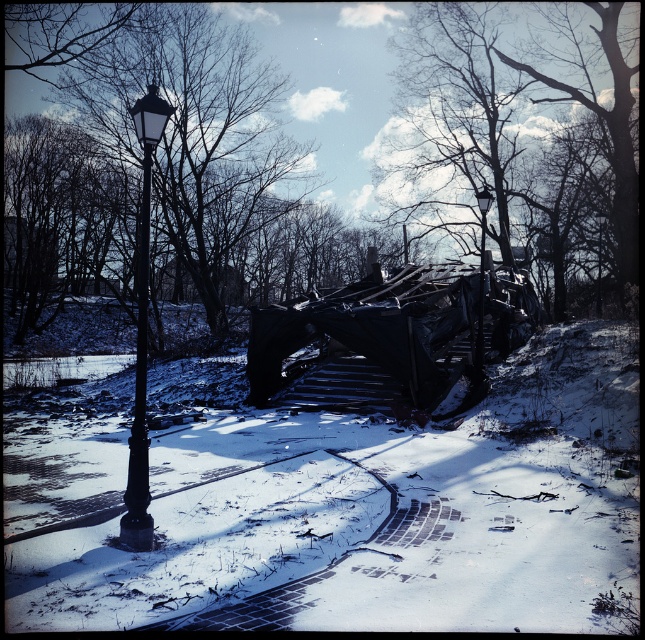
Does dark brown wood tree at upper center appear on the left side of smooth black lamp post at left?

Incorrect, dark brown wood tree at upper center is not on the left side of smooth black lamp post at left.

What do you see at coordinates (521, 140) in the screenshot?
I see `dark brown wood tree at upper center` at bounding box center [521, 140].

Identify the location of dark brown wood tree at upper center. (521, 140).

Which of these two, dark brown wood tree at upper center or black matte street light at left, stands shorter?

Standing shorter between the two is black matte street light at left.

Who is positioned more to the left, dark brown wood tree at upper center or black matte street light at left?

Positioned to the left is black matte street light at left.

This screenshot has width=645, height=640. I want to click on dark brown wood tree at upper center, so click(x=521, y=140).

Is smooth black lamp post at left behind black metal street light at upper center?

No, smooth black lamp post at left is closer to the viewer.

Measure the distance between smooth black lamp post at left and camera.

smooth black lamp post at left is 6.28 meters from camera.

Find the location of a particular element. The width and height of the screenshot is (645, 640). smooth black lamp post at left is located at coordinates (181, 120).